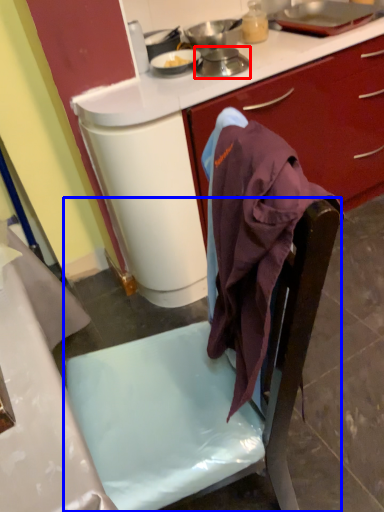
Question: Which object is further to the camera taking this photo, kitchen appliance (highlighted by a red box) or chair (highlighted by a blue box)?

Choices:
 (A) kitchen appliance
 (B) chair

Answer: (A)